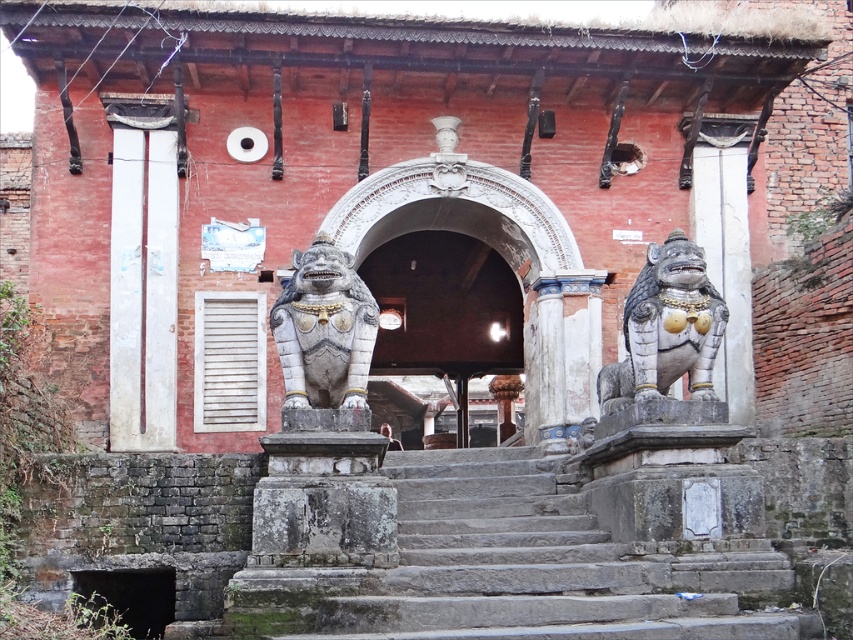
You are standing at the entrance of a traditional temple with gray stone stairs at center leading up to the arched doorway. If you want to reach the doorway, how many steps do you need to climb?

The gray stone stairs at center is 42.83 meters from viewer. The number of steps required to reach the doorway cannot be determined from the given information.

You are a visitor at the temple entrance and want to take a photo of both the dark stone archway at center and the polished stone lion at right. To ensure both are fully visible in your frame, which object should you position closer to the camera?

You should position the dark stone archway at center closer to the camera because it might be wider than the polished stone lion at right, allowing both to fit within the frame.